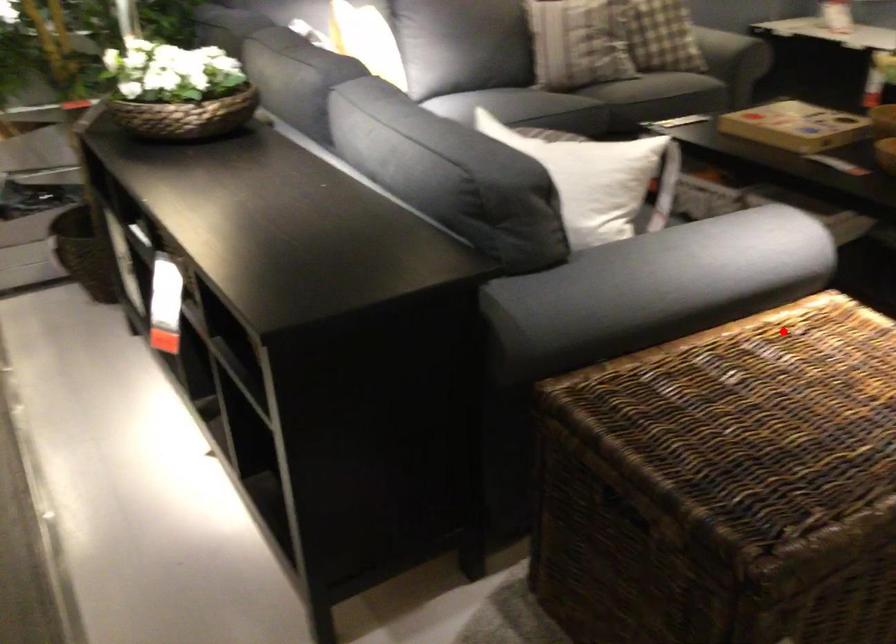
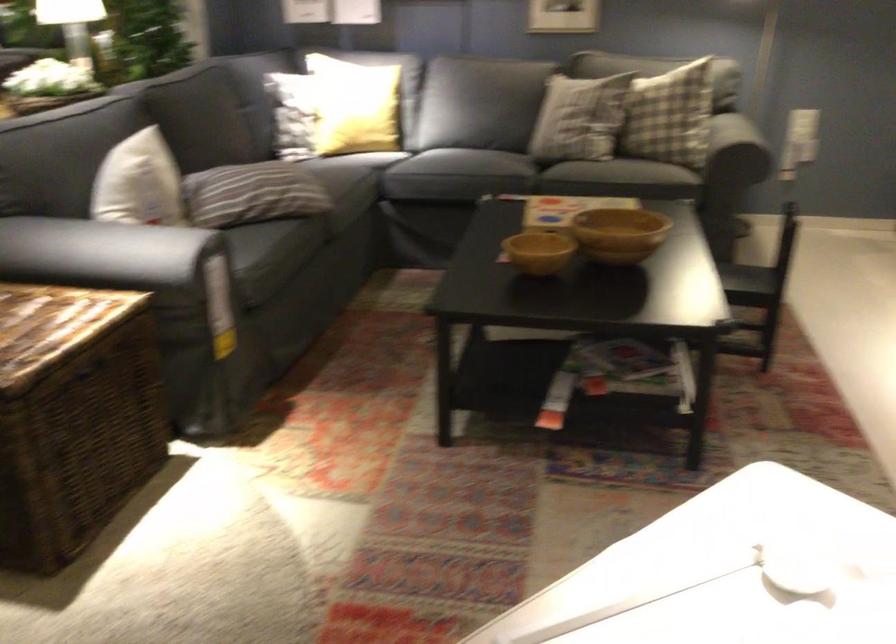
Question: I am providing you with two images of the same scene from different viewpoints. A red point is shown in image1. For the corresponding object point in image2, is it positioned nearer or farther from the camera?

Choices:
 (A) Nearer
 (B) Farther

Answer: (B)